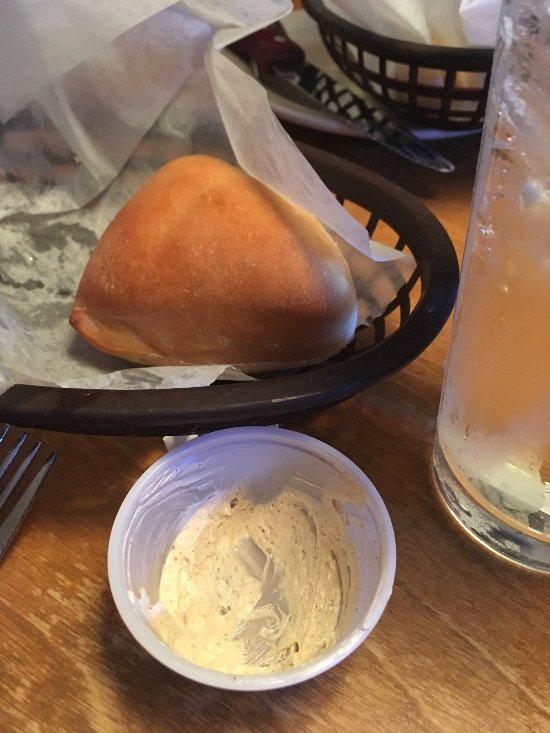
The image size is (550, 733). I want to click on glass, so click(x=514, y=399).